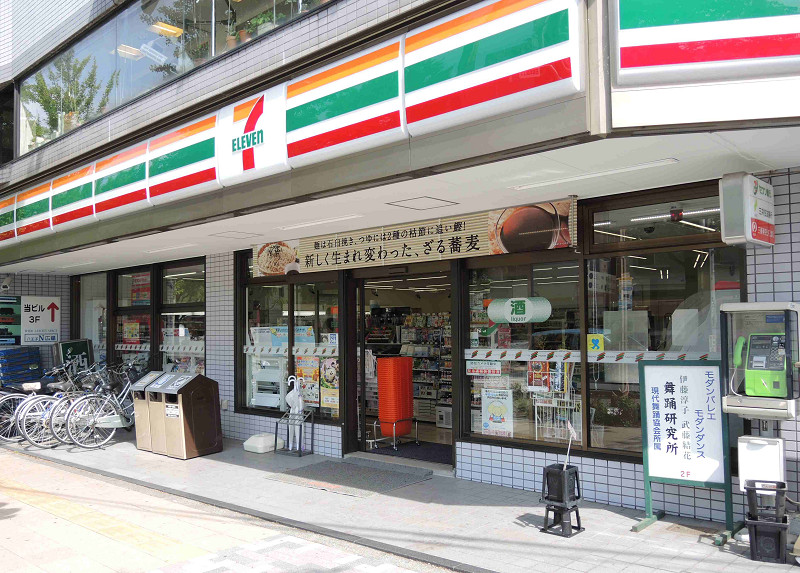
Locate an element on the screen. This screenshot has height=573, width=800. doorway is located at coordinates (420, 350).